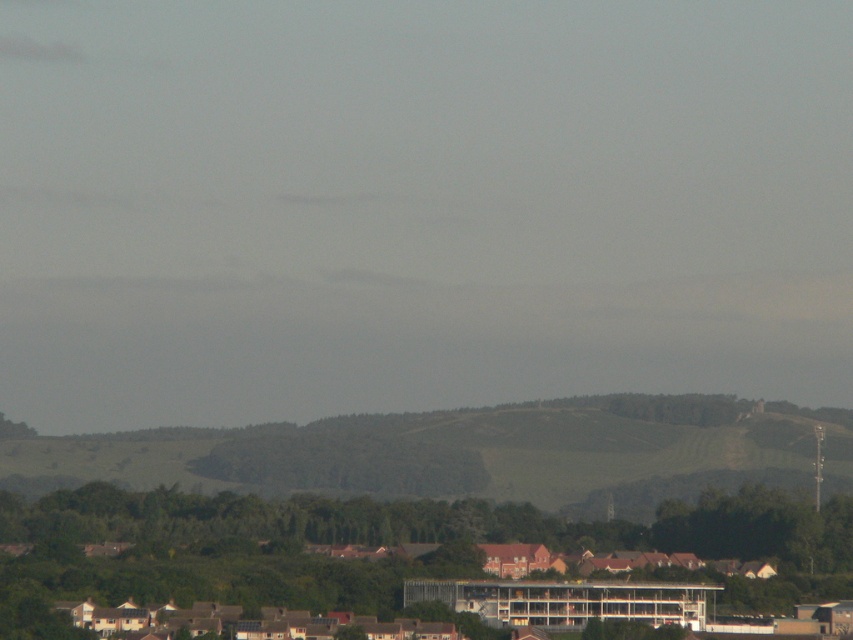
How much distance is there between green leafy tree at lower center and green grassy hillside at center?

green leafy tree at lower center is 37.78 feet away from green grassy hillside at center.

Can you confirm if green leafy tree at lower center is smaller than green grassy hillside at center?

No, green leafy tree at lower center is not smaller than green grassy hillside at center.

You are a GUI agent. You are given a task and a screenshot of the screen. Output one action in this format:
    pyautogui.click(x=<x>, y=<y>)
    Task: Click on the green leafy tree at lower center
    
    Given the screenshot: What is the action you would take?
    pyautogui.click(x=376, y=545)

Locate an element on the screen. The width and height of the screenshot is (853, 640). green leafy tree at lower center is located at coordinates (376, 545).